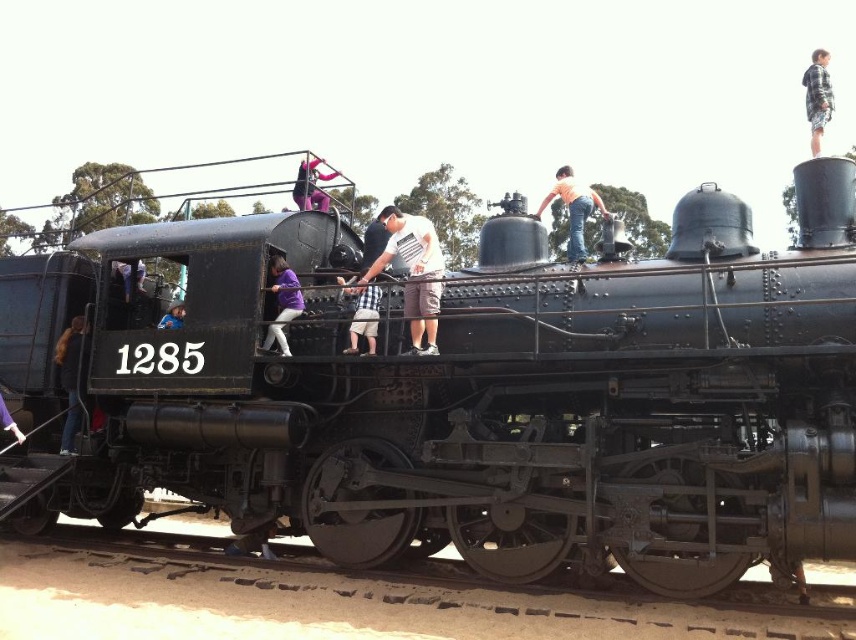
Does point (239, 538) come farther from viewer compared to point (162, 324)?

No.

Based on the photo, who is more forward, (230, 556) or (181, 323)?

Positioned in front is point (230, 556).

Where is `blue denim jeans at lower center`? Image resolution: width=856 pixels, height=640 pixels. blue denim jeans at lower center is located at coordinates (253, 541).

Does point (815, 100) come farther from viewer compared to point (163, 316)?

No, it is not.

Based on the photo, does plaid shirt at upper right appear on the left side of blue denim jeans at lower left?

Incorrect, plaid shirt at upper right is not on the left side of blue denim jeans at lower left.

Describe the element at coordinates (817, 97) in the screenshot. Image resolution: width=856 pixels, height=640 pixels. I see `plaid shirt at upper right` at that location.

In order to click on plaid shirt at upper right in this screenshot , I will do `click(817, 97)`.

Looking at this image, does matte black locomotive at center have a greater height compared to metal/rough train track at lower center?

Yes.

Which of these two, matte black locomotive at center or metal/rough train track at lower center, stands shorter?

With less height is metal/rough train track at lower center.

Between point (477, 378) and point (281, 588), which one is positioned in front?

Positioned in front is point (281, 588).

The height and width of the screenshot is (640, 856). I want to click on matte black locomotive at center, so click(467, 392).